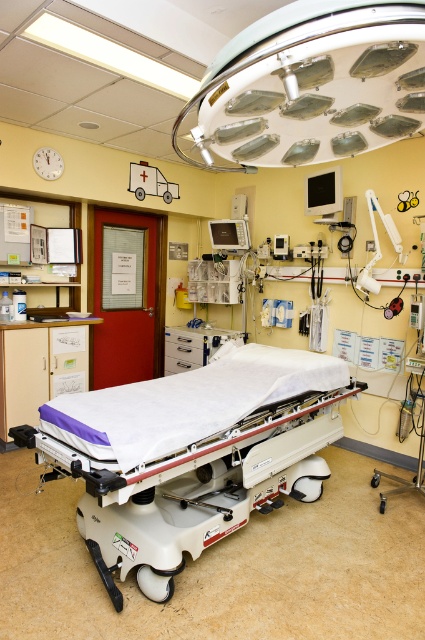
Question: Among these points, which one is farthest from the camera?

Choices:
 (A) (376, 204)
 (B) (167, 180)
 (C) (115, 588)

Answer: (B)

Question: Considering the relative positions of white matte bed at center and matte white surgical light at upper center in the image provided, where is white matte bed at center located with respect to matte white surgical light at upper center?

Choices:
 (A) below
 (B) above

Answer: (A)

Question: Which object appears farthest from the camera in this image?

Choices:
 (A) matte white ambulance at upper left
 (B) white matte bed at center
 (C) white plastic medical arm at center-right

Answer: (A)

Question: From the image, what is the correct spatial relationship of white plastic medical arm at center-right in relation to matte white ambulance at upper left?

Choices:
 (A) right
 (B) left

Answer: (A)

Question: Is matte white surgical light at upper center to the left of matte white ambulance at upper left from the viewer's perspective?

Choices:
 (A) yes
 (B) no

Answer: (B)

Question: Among these points, which one is nearest to the camera?

Choices:
 (A) (367, 51)
 (B) (373, 285)

Answer: (A)